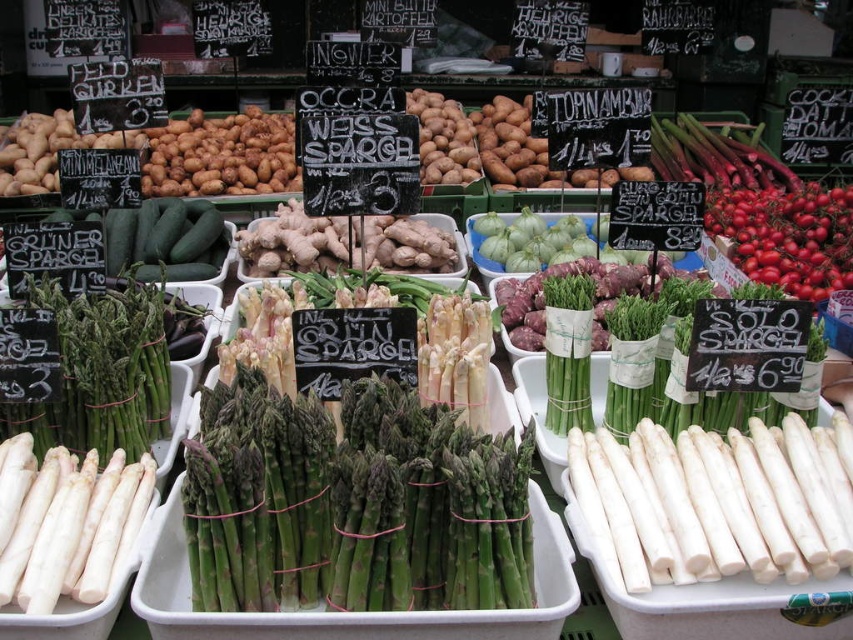
Who is more distant from viewer, (221, 401) or (573, 449)?

The point (573, 449) is behind.

Is green matte asparagus at center smaller than white smooth asparagus at center?

Actually, green matte asparagus at center might be larger than white smooth asparagus at center.

You are a GUI agent. You are given a task and a screenshot of the screen. Output one action in this format:
    pyautogui.click(x=<x>, y=<y>)
    Task: Click on the green matte asparagus at center
    The image size is (853, 640).
    Given the screenshot: What is the action you would take?
    pyautogui.click(x=357, y=500)

Is green matte asparagus at center positioned behind ripe red tomatoes at upper right?

No, it is in front of ripe red tomatoes at upper right.

Does point (380, 500) come farther from viewer compared to point (830, 276)?

No.

Who is more distant from viewer, (300, 451) or (751, 195)?

The point (751, 195) is more distant.

Image resolution: width=853 pixels, height=640 pixels. I want to click on green matte asparagus at center, so click(x=357, y=500).

Between point (711, 547) and point (723, 227), which one is positioned behind?

Point (723, 227)

Which is more to the right, white smooth asparagus at center or ripe red tomatoes at upper right?

ripe red tomatoes at upper right is more to the right.

Which is in front, point (613, 522) or point (711, 212)?

Positioned in front is point (613, 522).

Locate an element on the screen. white smooth asparagus at center is located at coordinates (717, 500).